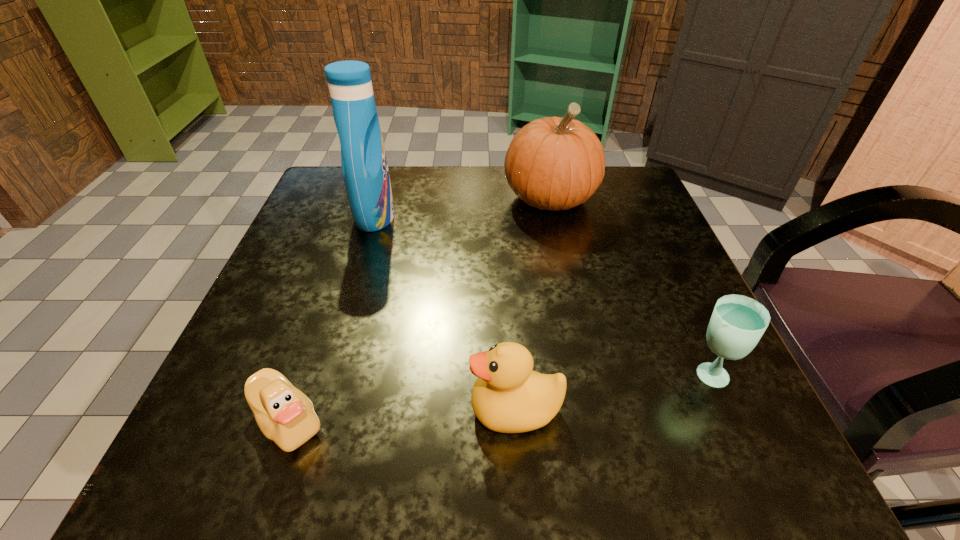
In order to click on vacant region that satisfies the following two spatial constraints: 1. on the stem of the second tallest object; 2. at the beak of the taller duck in this screenshot , I will do click(x=594, y=409).

You are a GUI agent. You are given a task and a screenshot of the screen. Output one action in this format:
    pyautogui.click(x=<x>, y=<y>)
    Task: Click on the vacant space that satisfies the following two spatial constraints: 1. on the front-facing side of the tallest object; 2. on the back side of the rightmost object
    This screenshot has height=540, width=960.
    Given the screenshot: What is the action you would take?
    pyautogui.click(x=327, y=374)

Locate an element on the screen. The width and height of the screenshot is (960, 540). vacant point that satisfies the following two spatial constraints: 1. on the front-facing side of the tallest object; 2. on the right side of the rightmost object is located at coordinates (327, 374).